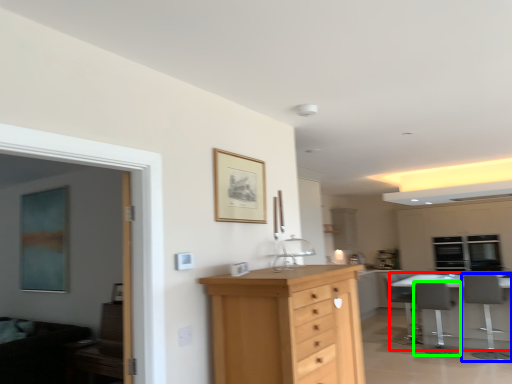
Question: Which object is positioned farthest from table (highlighted by a red box)? Select from chair (highlighted by a blue box) and chair (highlighted by a green box).

Choices:
 (A) chair
 (B) chair

Answer: (B)